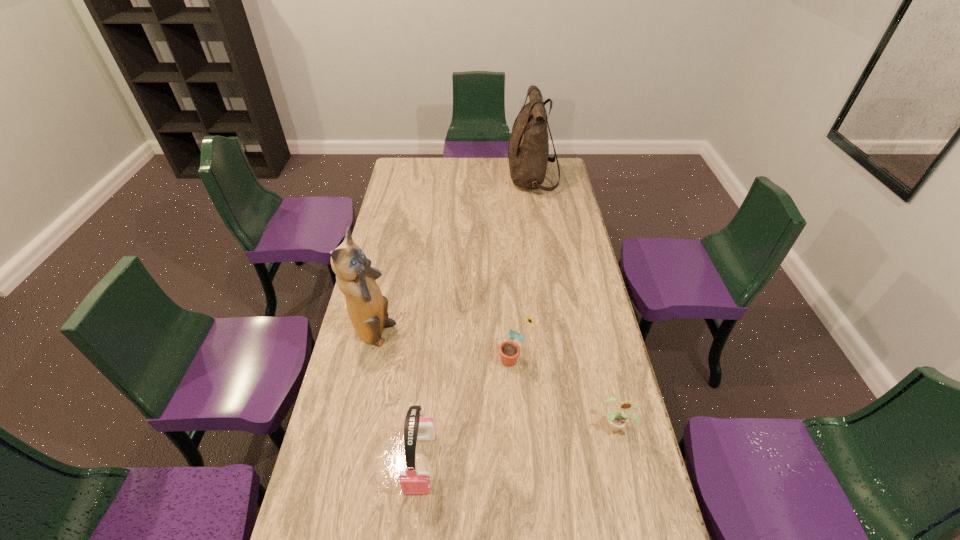
The image size is (960, 540). Find the location of `free location located on the face of the cat`. free location located on the face of the cat is located at coordinates (468, 334).

The height and width of the screenshot is (540, 960). Find the location of `free point located on the flower of the taller sunflower`. free point located on the flower of the taller sunflower is located at coordinates (393, 360).

Find the location of a particular element. vacant area situated 0.100m on the flower of the taller sunflower is located at coordinates (468, 360).

Identify the location of vacant space located 0.280m on the flower of the taller sunflower. (414, 360).

Image resolution: width=960 pixels, height=540 pixels. Identify the location of free region located 0.100m on the outer surface of the earphone. (413, 538).

In order to click on free location located 0.210m on the front-facing side of the nearer sunflower in this screenshot , I will do `click(638, 518)`.

Locate an element on the screen. The image size is (960, 540). object located in the far edge section of the desktop is located at coordinates (528, 149).

Where is `object present at the left edge`? The image size is (960, 540). object present at the left edge is located at coordinates (367, 308).

At what (x,y) coordinates should I click in order to perform the action: click on backpack present at the right edge. Please return your answer as a coordinate pair (x, y). This screenshot has height=540, width=960. Looking at the image, I should click on (528, 149).

Locate an element on the screen. sunflower located at the right edge is located at coordinates (617, 419).